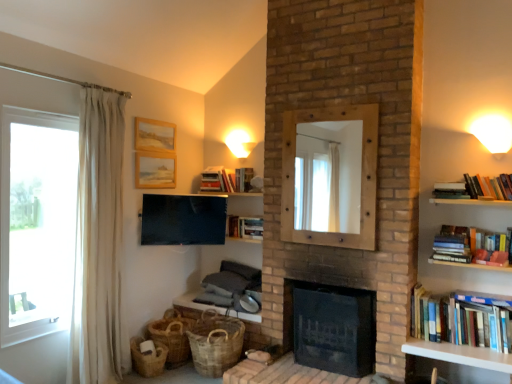
I want to click on vacant area on top of transparent glass window at left (from a real-world perspective), so click(x=32, y=112).